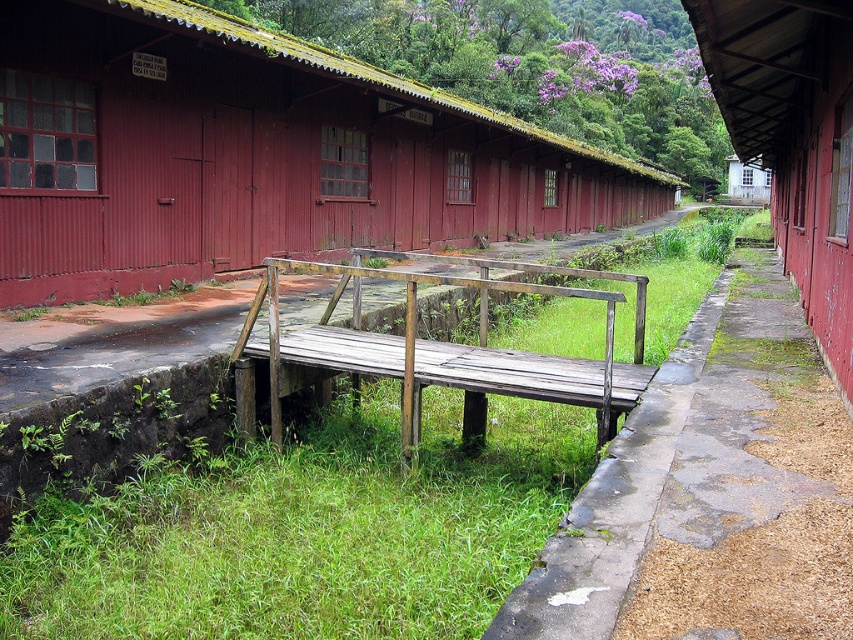
Does green grass at center have a greater width compared to rusty metal hut at right?

No.

Does green grass at center have a smaller size compared to rusty metal hut at right?

Indeed, green grass at center has a smaller size compared to rusty metal hut at right.

Find the location of a particular element. green grass at center is located at coordinates (303, 529).

Can you confirm if rustic wood hut at center is bigger than weathered wood rail at center?

Yes.

Between rustic wood hut at center and weathered wood rail at center, which one has more height?

rustic wood hut at center

At what (x,y) coordinates should I click in order to perform the action: click on rustic wood hut at center. Please return your answer as a coordinate pair (x, y). Looking at the image, I should click on [x=254, y=154].

Can you confirm if green grass at center is bigger than white wood hut at upper right?

Incorrect, green grass at center is not larger than white wood hut at upper right.

Which is behind, point (378, 401) or point (749, 168)?

The point (749, 168) is behind.

Identify the location of green grass at center. This screenshot has width=853, height=640. (303, 529).